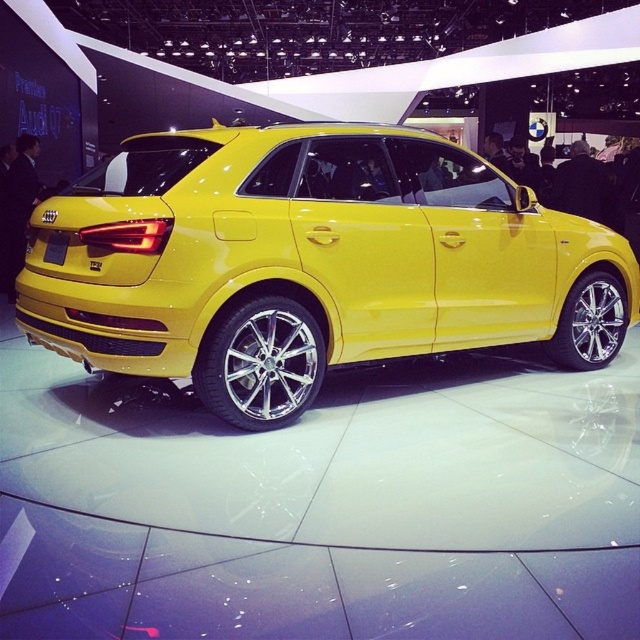
You are a photographer at an auto show and want to capture a clear shot of the yellow metallic car at center without the yellow matte license plate at rear obstructing the view. Is this possible given their positions?

The yellow metallic car at center is in front of the yellow matte license plate at rear, so the license plate is behind the car. Therefore, the photographer can capture a clear shot of the yellow metallic car at center without obstruction from the yellow matte license plate at rear.

You are a photographer at an auto show. You need to position a light source to the left of the yellow metallic car at center so that it illuminates the yellow matte license plate at rear. Considering the car might be wider than the license plate, where should you place the light to ensure the light reaches the license plate without being blocked by the car?

The yellow metallic car at center might be wider than the yellow matte license plate at rear, so place the light source to the left of the car but positioned closer to the rear area to avoid blocking the light from reaching the license plate.